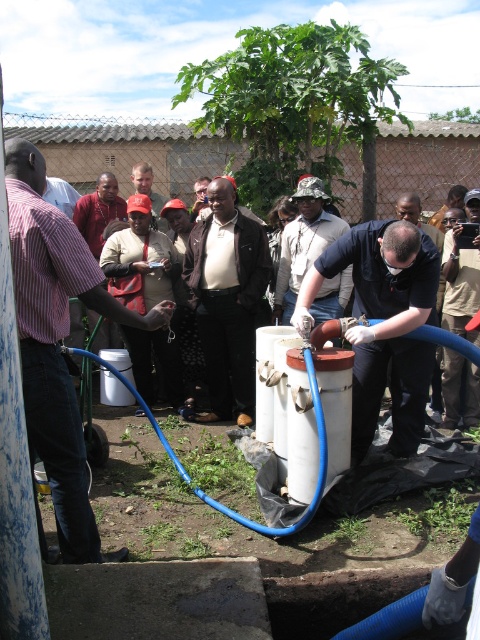
You are a delivery person who needs to place a small package between the light brown leather jacket at center and the red cap at center. Considering their sizes, which object should you place the package closer to?

The light brown leather jacket at center is bigger than the red cap at center, so you should place the package closer to the red cap at center to ensure enough space between them.

You are a delivery person who needs to place a box on top of the white matte tank at center. Considering the height of the black matte shirt at center, can you estimate if the box will be stable on the tank?

The white matte tank at center is taller than the black matte shirt at center. Since the tank is taller, the box placed on top of it should be stable as it provides a solid base.

You are a delivery person who needs to place a small box between the light brown leather jacket at center and the red cap at center. Can you fit the box there without moving either object?

The light brown leather jacket at center might be wider than red cap at center, so there might not be enough space to fit the box between them.